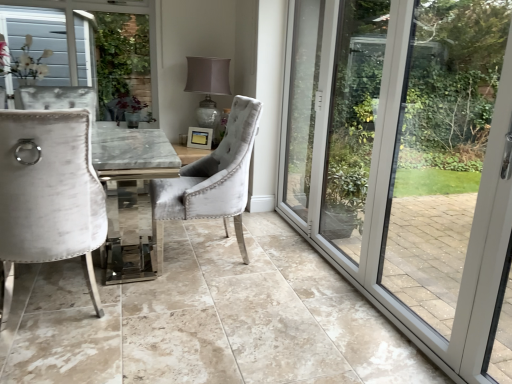
Question: Does velvet grey chair at center, acting as the second chair starting from the left, appear on the left side of matte silver lamp at center?

Choices:
 (A) yes
 (B) no

Answer: (B)

Question: Considering the relative sizes of velvet grey chair at center, acting as the second chair starting from the left, and matte silver lamp at center in the image provided, is velvet grey chair at center, acting as the second chair starting from the left, shorter than matte silver lamp at center?

Choices:
 (A) no
 (B) yes

Answer: (A)

Question: Considering the relative sizes of velvet grey chair at center, acting as the second chair starting from the left, and matte silver lamp at center in the image provided, is velvet grey chair at center, acting as the second chair starting from the left, thinner than matte silver lamp at center?

Choices:
 (A) no
 (B) yes

Answer: (A)

Question: Is velvet grey chair at center, which is counted as the first chair, starting from the right, positioned with its back to matte silver lamp at center?

Choices:
 (A) no
 (B) yes

Answer: (A)

Question: Is matte silver lamp at center inside velvet grey chair at center, acting as the second chair starting from the left?

Choices:
 (A) no
 (B) yes

Answer: (A)

Question: From a real-world perspective, is velvet grey chair at center, which is counted as the first chair, starting from the right, positioned under matte silver lamp at center based on gravity?

Choices:
 (A) no
 (B) yes

Answer: (B)

Question: Would you say velvet white chair at left, acting as the second chair starting from the right, contains velvet grey chair at center, which is counted as the first chair, starting from the right?

Choices:
 (A) yes
 (B) no

Answer: (B)

Question: Would you consider velvet white chair at left, acting as the second chair starting from the right, to be distant from velvet grey chair at center, which is counted as the first chair, starting from the right?

Choices:
 (A) yes
 (B) no

Answer: (B)

Question: Does velvet white chair at left, acting as the second chair starting from the right, have a greater height compared to velvet grey chair at center, acting as the second chair starting from the left?

Choices:
 (A) yes
 (B) no

Answer: (A)

Question: From a real-world perspective, is velvet white chair at left, acting as the second chair starting from the right, on velvet grey chair at center, which is counted as the first chair, starting from the right?

Choices:
 (A) no
 (B) yes

Answer: (A)

Question: Is velvet white chair at left, placed as the 1th chair when sorted from left to right, in contact with velvet grey chair at center, acting as the second chair starting from the left?

Choices:
 (A) yes
 (B) no

Answer: (B)

Question: Can you confirm if velvet white chair at left, placed as the 1th chair when sorted from left to right, is thinner than velvet grey chair at center, acting as the second chair starting from the left?

Choices:
 (A) yes
 (B) no

Answer: (A)

Question: Can you confirm if matte silver lamp at center is wider than transparent glass door at right?

Choices:
 (A) no
 (B) yes

Answer: (B)